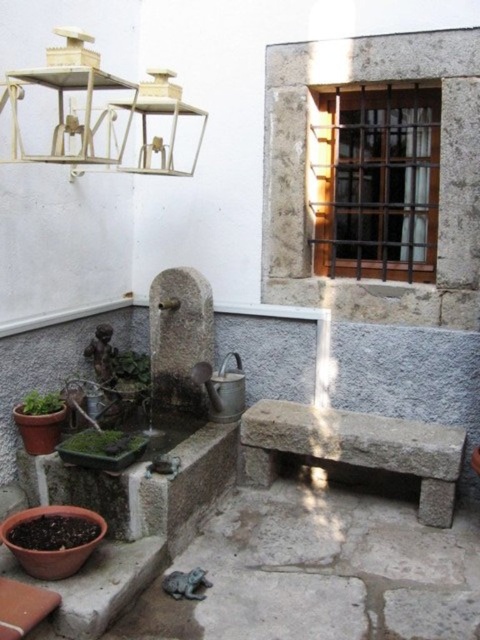
Which is behind, point (118, 445) or point (26, 403)?

Point (26, 403)

Find the location of a particular element. green leafy plant at lower center is located at coordinates (101, 444).

Can you confirm if green leafy plant at lower left is taller than green matte planter at lower left?

Yes.

Who is shorter, green leafy plant at lower left or green matte planter at lower left?

Standing shorter between the two is green matte planter at lower left.

The width and height of the screenshot is (480, 640). What are the coordinates of `green leafy plant at lower left` in the screenshot? It's located at (127, 368).

Does green leafy plant at lower center have a smaller size compared to green leafy plant at lower left?

Correct, green leafy plant at lower center occupies less space than green leafy plant at lower left.

Does green leafy plant at lower center come in front of green leafy plant at lower left?

Yes, it is in front of green leafy plant at lower left.

Is point (84, 435) closer to viewer compared to point (148, 368)?

Yes, point (84, 435) is in front of point (148, 368).

Identify the location of green leafy plant at lower center. The image size is (480, 640). (101, 444).